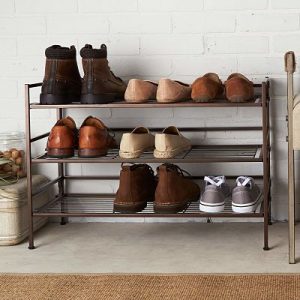
Locate an element on the screen. middle shelf is located at coordinates (57, 135), (95, 140), (138, 145), (170, 147).